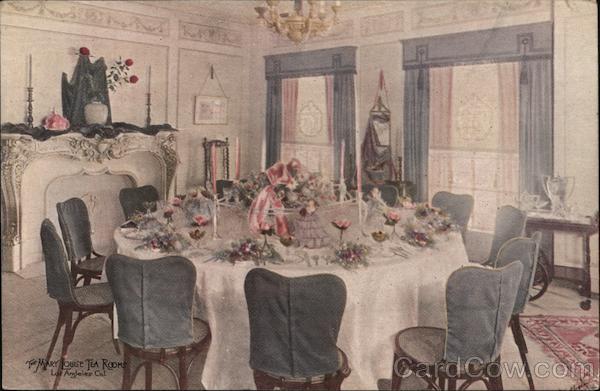
At what (x,y) coordinates should I click in order to perform the action: click on artwork. Please return your answer as a coordinate pair (x, y). Image resolution: width=600 pixels, height=391 pixels. Looking at the image, I should click on (215, 114).